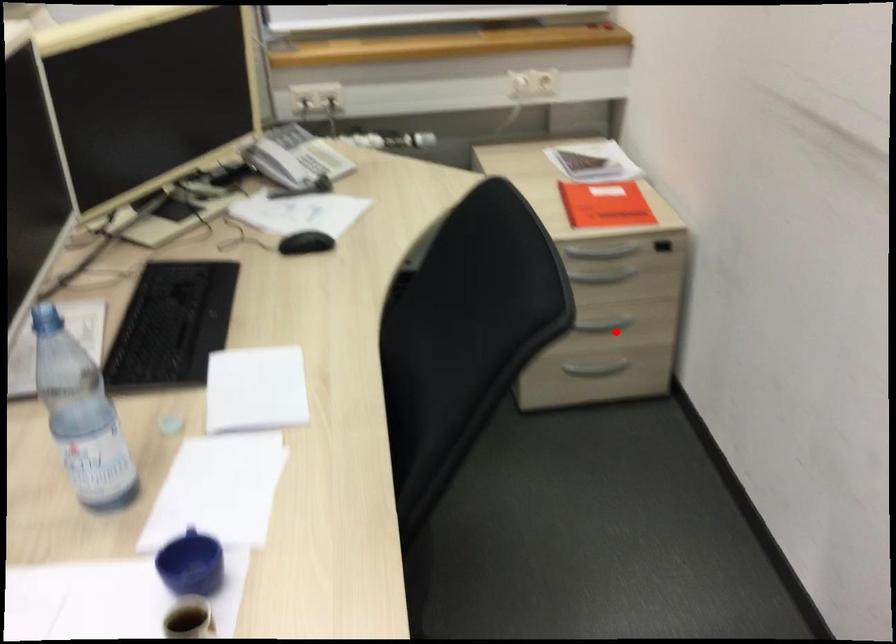
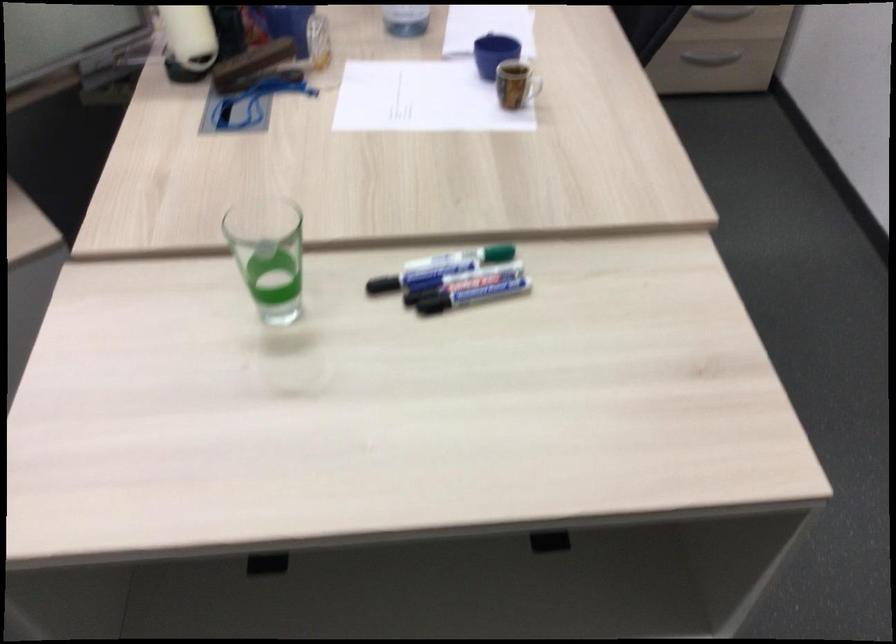
Question: A red point is marked in image1. In image2, is the corresponding 3D point closer to the camera or farther? Reply with the corresponding letter.

Choices:
 (A) The corresponding 3D point is closer.
 (B) The corresponding 3D point is farther.

Answer: (B)